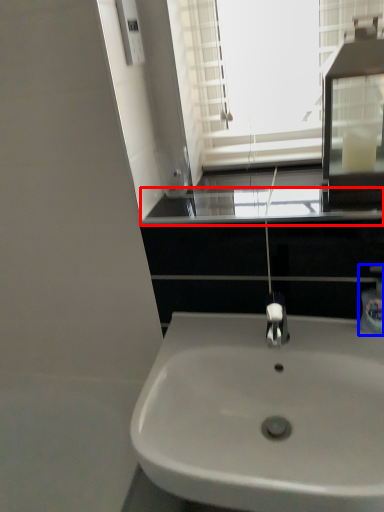
Question: Which point is closer to the camera, window sill (highlighted by a red box) or soap dispenser (highlighted by a blue box)?

Choices:
 (A) window sill
 (B) soap dispenser

Answer: (A)